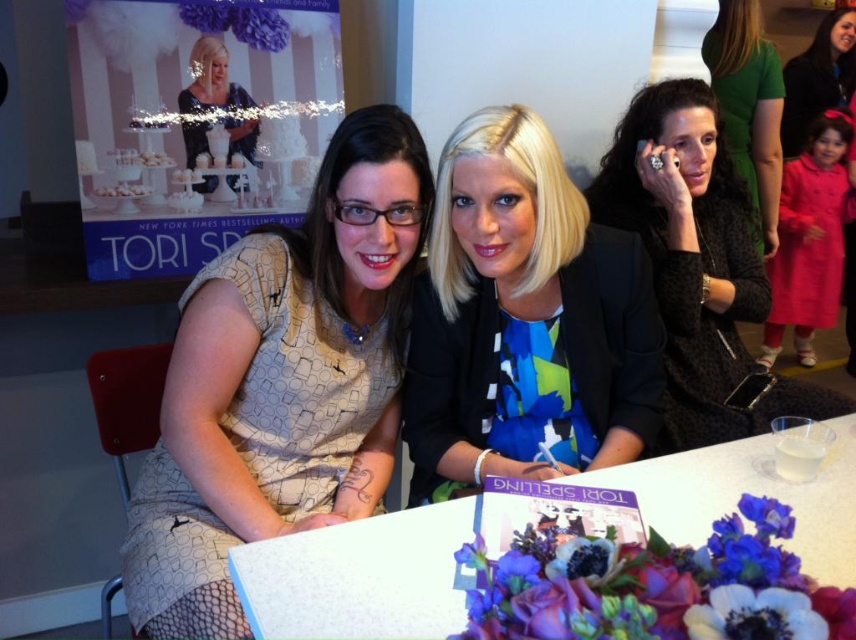
Question: Is white textured dress at center positioned before black textured jacket at upper right?

Choices:
 (A) yes
 (B) no

Answer: (A)

Question: Which of the following is the farthest from the observer?

Choices:
 (A) (215, 90)
 (B) (348, 266)
 (C) (735, 484)

Answer: (A)

Question: Which of the following is the closest to the observer?

Choices:
 (A) (394, 547)
 (B) (205, 444)
 (C) (716, 148)
 (D) (571, 384)

Answer: (A)

Question: Which of the following is the closest to the observer?

Choices:
 (A) (749, 588)
 (B) (259, 410)
 (C) (419, 285)

Answer: (A)

Question: Is velvety pink coat at right to the right of matte black dress at upper right from the viewer's perspective?

Choices:
 (A) yes
 (B) no

Answer: (B)

Question: Is blue printed blouse at center closer to the viewer compared to matte black dress at upper right?

Choices:
 (A) no
 (B) yes

Answer: (B)